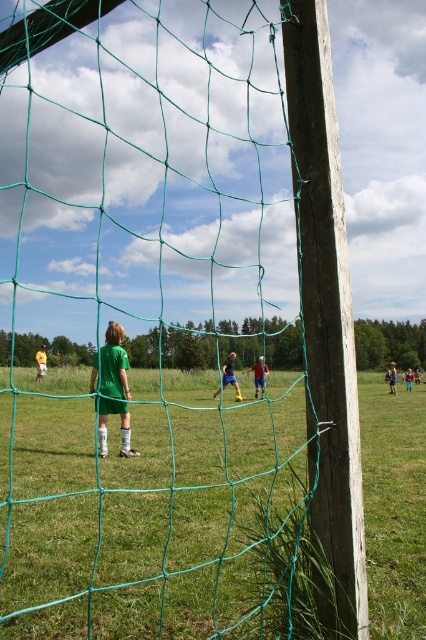
You are a referee standing at the edge of the soccer field. You need to decide if the two players, the green matte soccer player at center and the green jersey boy at center, are within the required 10 meters distance for a penalty kick. Can you confirm their distance meets the requirement?

The distance between the green matte soccer player at center and the green jersey boy at center is 11.20 meters, which exceeds the 10 meters requirement. Therefore, they are not within the required distance for a penalty kick.

You are a photographer trying to capture a clear shot of both the green matte soccer player at center and the green jersey boy at center through the netting. Based on their sizes in the image, which one might be easier to focus on and why?

The green jersey boy at center might be easier to focus on because he occupies more space in the image than the green matte soccer player at center, making him a clearer target through the netting.